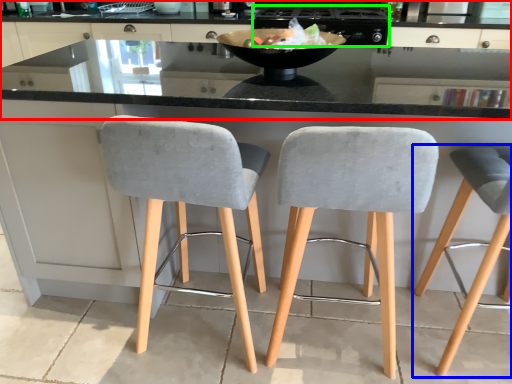
Question: Which is nearer to the cabinetry (highlighted by a red box)? chair (highlighted by a blue box) or appliance (highlighted by a green box).

Choices:
 (A) chair
 (B) appliance

Answer: (B)